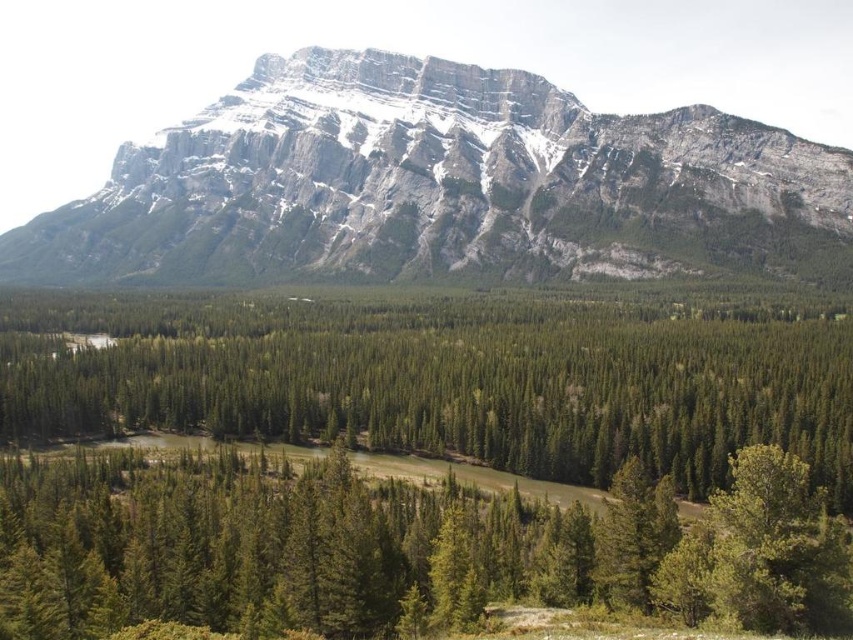
Question: Is rocky gray mountain range at upper center above green matte tree at lower right?

Choices:
 (A) yes
 (B) no

Answer: (A)

Question: Estimate the real-world distances between objects in this image. Which object is closer to the green matte tree at lower right?

Choices:
 (A) green textured forest at center
 (B) rocky gray mountain range at upper center

Answer: (A)

Question: Which point is farther to the camera?

Choices:
 (A) green textured forest at center
 (B) rocky gray mountain range at upper center
 (C) green matte tree at lower right

Answer: (B)

Question: Is rocky gray mountain range at upper center below green matte tree at lower center?

Choices:
 (A) no
 (B) yes

Answer: (A)

Question: Is rocky gray mountain range at upper center closer to camera compared to green matte tree at lower center?

Choices:
 (A) no
 (B) yes

Answer: (A)

Question: Among these points, which one is farthest from the camera?

Choices:
 (A) (657, 500)
 (B) (663, 540)

Answer: (A)